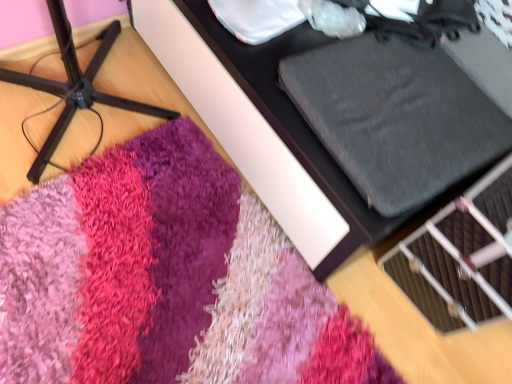
Question: From the image's perspective, does shaggy carpet at lower left, arranged as the second furniture when viewed from the right, appear lower than textured gray cushion at upper right, arranged as the 1th furniture when viewed from the right?

Choices:
 (A) yes
 (B) no

Answer: (A)

Question: Is shaggy carpet at lower left, arranged as the second furniture when viewed from the right, taller than textured gray cushion at upper right, the 2th furniture positioned from the left?

Choices:
 (A) yes
 (B) no

Answer: (A)

Question: From the image's perspective, is shaggy carpet at lower left, arranged as the second furniture when viewed from the right, located above textured gray cushion at upper right, the 2th furniture positioned from the left?

Choices:
 (A) no
 (B) yes

Answer: (A)

Question: Are shaggy carpet at lower left, the 1th furniture positioned from the left, and textured gray cushion at upper right, arranged as the 1th furniture when viewed from the right, beside each other?

Choices:
 (A) yes
 (B) no

Answer: (B)

Question: Does shaggy carpet at lower left, arranged as the second furniture when viewed from the right, have a lesser width compared to textured gray cushion at upper right, arranged as the 1th furniture when viewed from the right?

Choices:
 (A) yes
 (B) no

Answer: (A)

Question: Is shaggy carpet at lower left, the 1th furniture positioned from the left, far from textured gray cushion at upper right, the 2th furniture positioned from the left?

Choices:
 (A) no
 (B) yes

Answer: (A)

Question: From a real-world perspective, does shaggy pink rug at lower center stand above textured gray cushion at upper right, the 2th furniture positioned from the left?

Choices:
 (A) no
 (B) yes

Answer: (A)

Question: Can you confirm if shaggy pink rug at lower center is thinner than textured gray cushion at upper right, the 2th furniture positioned from the left?

Choices:
 (A) no
 (B) yes

Answer: (A)

Question: From the image's perspective, is shaggy pink rug at lower center located above textured gray cushion at upper right, the 2th furniture positioned from the left?

Choices:
 (A) no
 (B) yes

Answer: (A)

Question: Could textured gray cushion at upper right, the 2th furniture positioned from the left, be considered to be inside shaggy pink rug at lower center?

Choices:
 (A) no
 (B) yes

Answer: (A)

Question: Could you tell me if shaggy pink rug at lower center is turned towards textured gray cushion at upper right, arranged as the 1th furniture when viewed from the right?

Choices:
 (A) yes
 (B) no

Answer: (A)

Question: Is shaggy pink rug at lower center positioned with its back to textured gray cushion at upper right, the 2th furniture positioned from the left?

Choices:
 (A) yes
 (B) no

Answer: (A)

Question: Considering the relative sizes of textured gray cushion at upper right, the 2th furniture positioned from the left, and shaggy pink rug at lower center in the image provided, is textured gray cushion at upper right, the 2th furniture positioned from the left, thinner than shaggy pink rug at lower center?

Choices:
 (A) yes
 (B) no

Answer: (A)